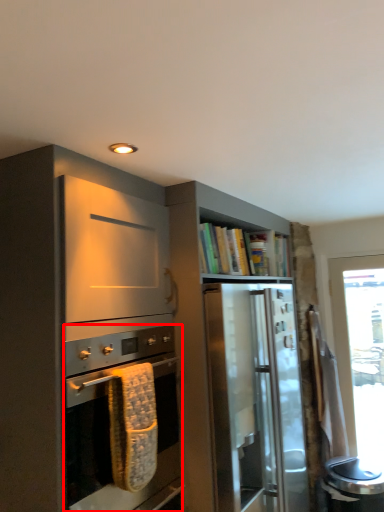
Question: From the image's perspective, considering the relative positions of oven (annotated by the red box) and cabinetry in the image provided, where is oven (annotated by the red box) located with respect to the staircase?

Choices:
 (A) above
 (B) below

Answer: (A)